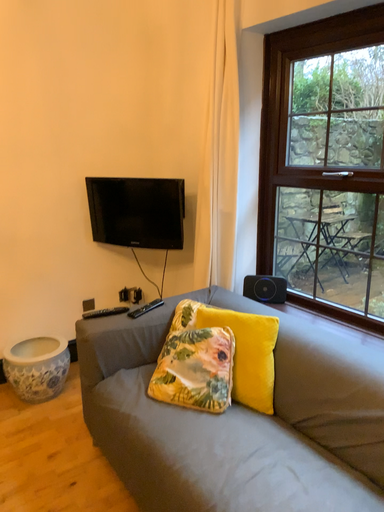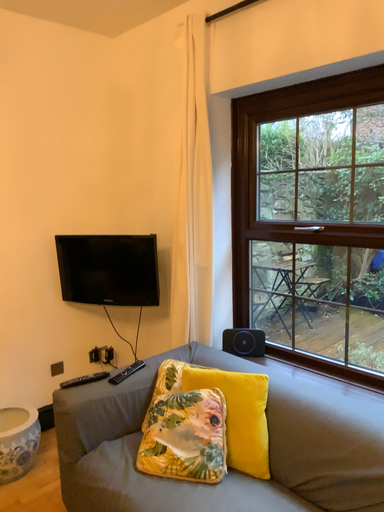
Question: Which way did the camera rotate in the video?

Choices:
 (A) rotated upward
 (B) rotated downward

Answer: (A)